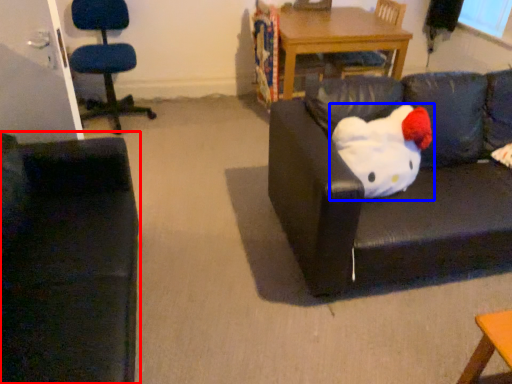
Question: Among these objects, which one is nearest to the camera, studio couch (highlighted by a red box) or toy (highlighted by a blue box)?

Choices:
 (A) studio couch
 (B) toy

Answer: (A)